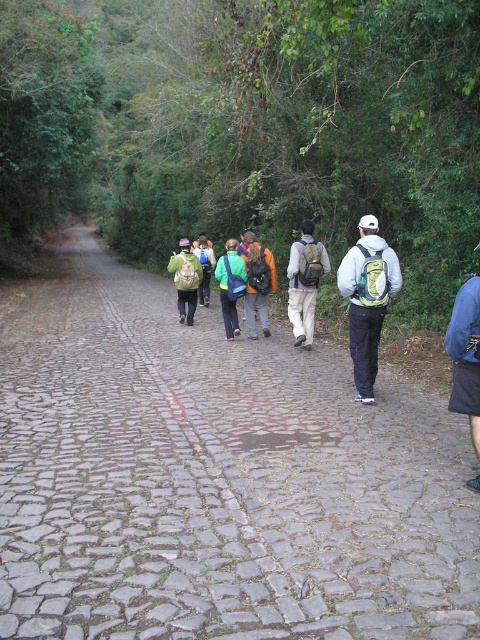
You are a hiker who wants to place your orange fabric backpack at center on the ground. The path has stones with different colors. Which stone color should you choose to place it so that it is most visible?

The orange fabric backpack at center is placed on reddish stones, so choosing a reddish stone would make it more visible against the background of dense greenery.

You are a hiker who wants to ensure your backpack is visible to others in the group. Which backpack, the matte green backpack at center or the orange fabric backpack at center, is more likely to be seen by someone looking from above the path?

The orange fabric backpack at center is more likely to be seen by someone looking from above the path because it is positioned above the matte green backpack at center.